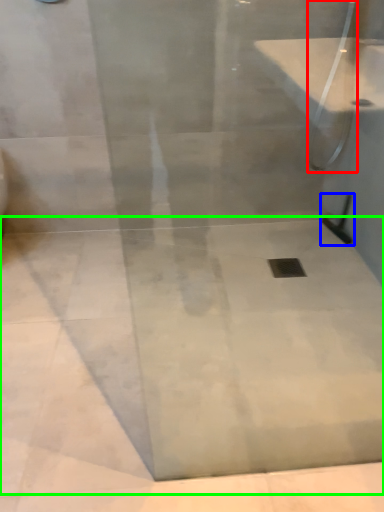
Question: Estimate the real-world distances between objects in this image. Which object is farther from shower (highlighted by a red box), shower (highlighted by a blue box) or concrete (highlighted by a green box)?

Choices:
 (A) shower
 (B) concrete

Answer: (B)